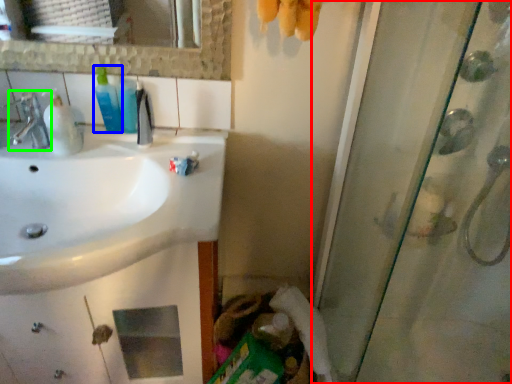
Question: Which object is the closest to the screen door (highlighted by a red box)? Choose among these: mouthwash (highlighted by a blue box) or tap (highlighted by a green box).

Choices:
 (A) mouthwash
 (B) tap

Answer: (A)